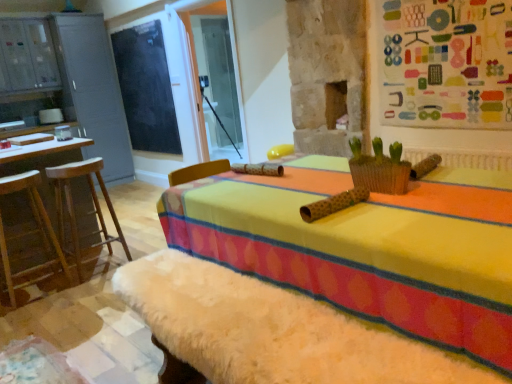
Question: From a real-world perspective, is blackboard at upper left positioned over wooden stool at left, the second furniture in the right-to-left sequence, based on gravity?

Choices:
 (A) yes
 (B) no

Answer: (A)

Question: Is blackboard at upper left looking in the opposite direction of wooden stool at left, the second furniture in the right-to-left sequence?

Choices:
 (A) no
 (B) yes

Answer: (A)

Question: Is blackboard at upper left surrounding wooden stool at left, the second furniture in the right-to-left sequence?

Choices:
 (A) yes
 (B) no

Answer: (B)

Question: Does blackboard at upper left turn towards wooden stool at left, which appears as the first furniture when viewed from the left?

Choices:
 (A) no
 (B) yes

Answer: (A)

Question: From a real-world perspective, is blackboard at upper left located beneath wooden stool at left, the second furniture in the right-to-left sequence?

Choices:
 (A) no
 (B) yes

Answer: (A)

Question: Considering the positions of wooden bar stool at left, the first furniture from the right, and wooden barstools at left in the image, is wooden bar stool at left, the first furniture from the right, taller or shorter than wooden barstools at left?

Choices:
 (A) short
 (B) tall

Answer: (A)

Question: Is wooden bar stool at left, the first furniture from the right, inside or outside of wooden barstools at left?

Choices:
 (A) outside
 (B) inside

Answer: (A)

Question: From the image's perspective, is wooden bar stool at left, which appears as the 2th furniture when viewed from the left, located above or below wooden barstools at left?

Choices:
 (A) below
 (B) above

Answer: (A)

Question: Considering the positions of point (59, 221) and point (65, 148), is point (59, 221) closer or farther from the camera than point (65, 148)?

Choices:
 (A) closer
 (B) farther

Answer: (B)

Question: Is wooden bar stool at left, which appears as the 2th furniture when viewed from the left, inside or outside of blackboard at upper left?

Choices:
 (A) outside
 (B) inside

Answer: (A)

Question: Is wooden bar stool at left, the first furniture from the right, in front of or behind blackboard at upper left in the image?

Choices:
 (A) front
 (B) behind

Answer: (A)

Question: From the image's perspective, is wooden bar stool at left, which appears as the 2th furniture when viewed from the left, positioned above or below blackboard at upper left?

Choices:
 (A) above
 (B) below

Answer: (B)

Question: Based on their sizes in the image, would you say wooden bar stool at left, the first furniture from the right, is bigger or smaller than blackboard at upper left?

Choices:
 (A) big
 (B) small

Answer: (A)

Question: In terms of width, does blackboard at upper left look wider or thinner when compared to wooden stool at left, the second furniture in the right-to-left sequence?

Choices:
 (A) wide
 (B) thin

Answer: (B)

Question: In the image, is blackboard at upper left positioned in front of or behind wooden stool at left, the second furniture in the right-to-left sequence?

Choices:
 (A) behind
 (B) front

Answer: (A)